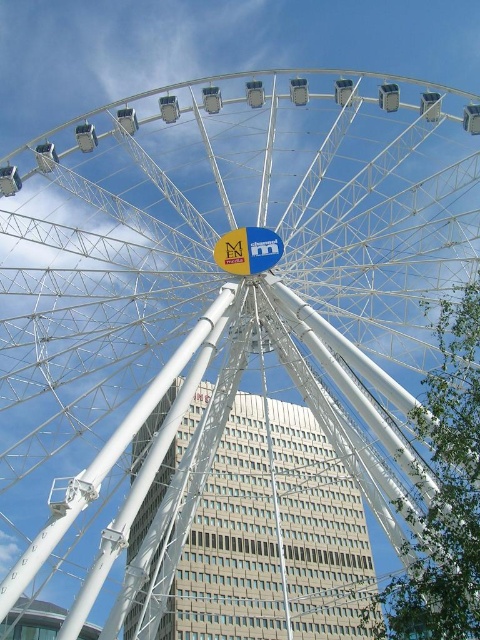
You are standing in front of the Ferris wheel and notice two central elements. One is the white metallic pole at center, and the other is the yellow fabric sign at center. From your perspective, which one is positioned to the left?

The white metallic pole at center is to the left of the yellow fabric sign at center.

You are standing in front of the Ferris wheel and notice the beige glass building at center and the white metallic pole at center. Which object is bigger?

The beige glass building at center is larger in size than the white metallic pole at center.

You are standing at the base of the Ferris wheel and want to take a photo of the beige glass building at center. Which direction should you face to ensure the building is centered in your camera view?

The beige glass building at center is located at point coordinates (273, 536), so you should face towards the center of the Ferris wheel to capture it in your photo.